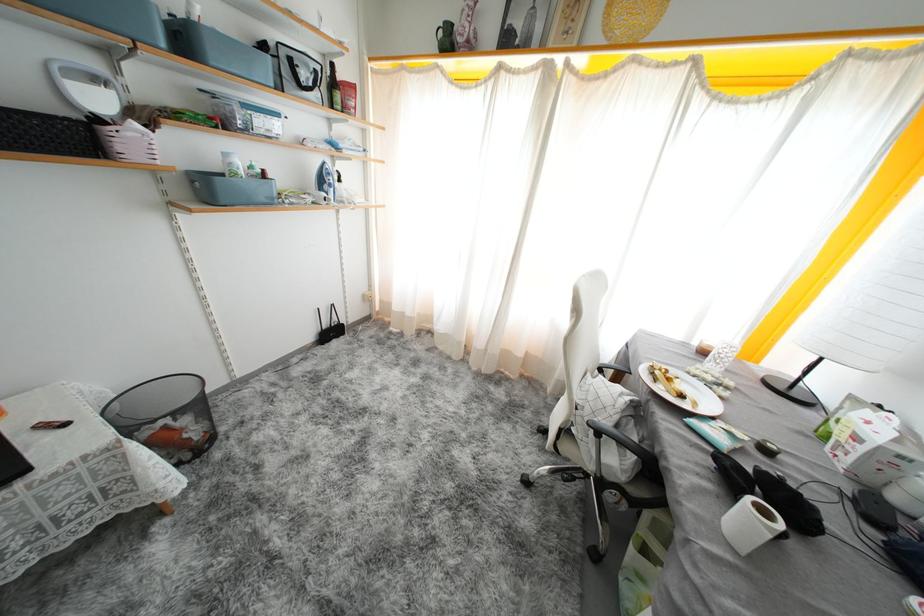
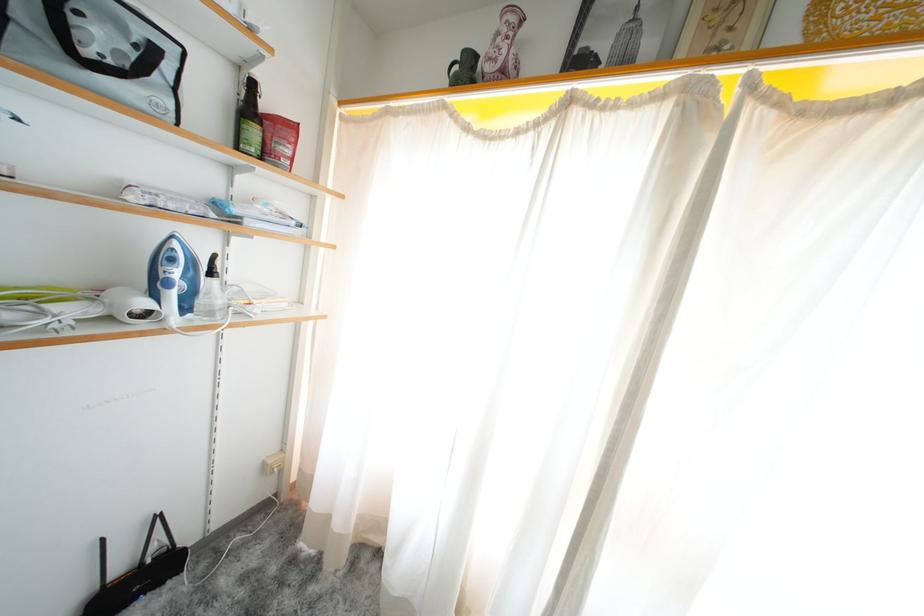
In the second image, find the point that corresponds to (346,185) in the first image.

(217, 278)